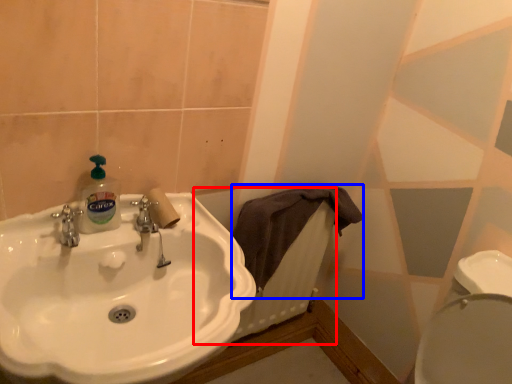
Question: Among these objects, which one is nearest to the camera, radiator (highlighted by a red box) or bath towel (highlighted by a blue box)?

Choices:
 (A) radiator
 (B) bath towel

Answer: (B)